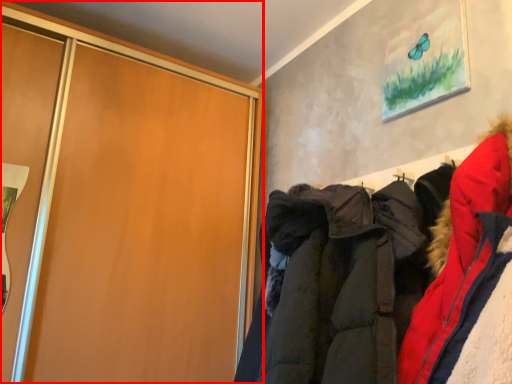
Question: From the image's perspective, what is the correct spatial positioning of cupboard (annotated by the red box) in reference to jacket?

Choices:
 (A) above
 (B) below

Answer: (A)